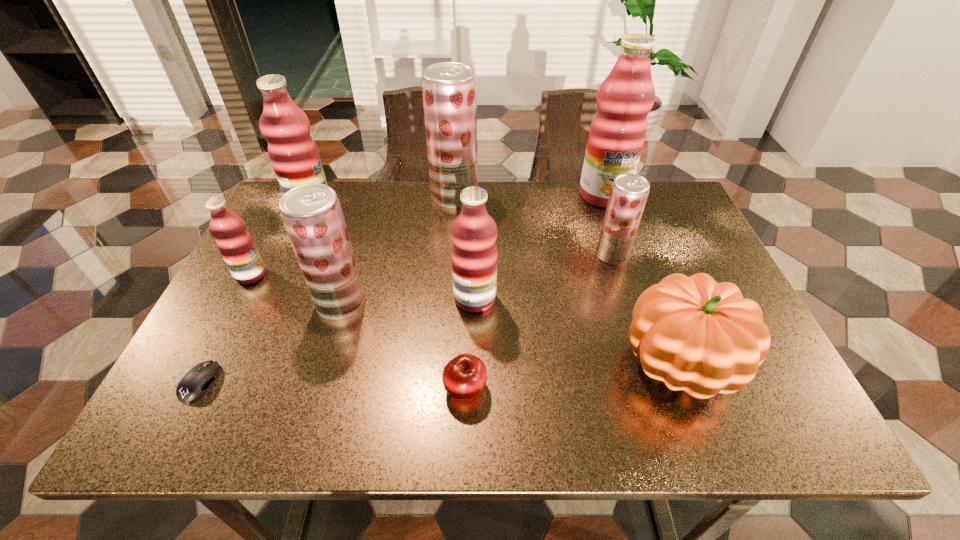
Locate an element on the screen. Image resolution: width=960 pixels, height=540 pixels. free space at the near left corner of the desktop is located at coordinates (234, 431).

Where is `free region at the far right corner of the desktop`? free region at the far right corner of the desktop is located at coordinates (659, 215).

Where is `unoccupied position between the third smallest pink fruit juice and the smallest pink fruit juice`? unoccupied position between the third smallest pink fruit juice and the smallest pink fruit juice is located at coordinates (281, 240).

You are a GUI agent. You are given a task and a screenshot of the screen. Output one action in this format:
    pyautogui.click(x=<x>, y=<y>)
    Task: Click on the free space between the pink apple and the smallest pink fruit juice
    The image size is (960, 540).
    Given the screenshot: What is the action you would take?
    pyautogui.click(x=358, y=332)

The height and width of the screenshot is (540, 960). What are the coordinates of `unoccupied area between the fourth object from left to right and the third pink fruit juice from left to right` in the screenshot? It's located at (408, 301).

You are a GUI agent. You are given a task and a screenshot of the screen. Output one action in this format:
    pyautogui.click(x=<x>, y=<y>)
    Task: Click on the free space between the orange pumpkin and the tallest object
    
    Given the screenshot: What is the action you would take?
    pyautogui.click(x=641, y=280)

Locate an element on the screen. empty space between the rightmost strawberry fruit juice and the biggest strawberry fruit juice is located at coordinates (534, 226).

At what (x,y) coordinates should I click in order to perform the action: click on free space that is in between the ninth tallest object and the third pink fruit juice from left to right. Please return your answer as a coordinate pair (x, y). The height and width of the screenshot is (540, 960). Looking at the image, I should click on (470, 343).

Locate an element on the screen. The width and height of the screenshot is (960, 540). free area in between the second smallest pink fruit juice and the fourth object from left to right is located at coordinates (408, 301).

Where is `vacant area between the fifth fruit juice from right to left and the black computer equipment`? Image resolution: width=960 pixels, height=540 pixels. vacant area between the fifth fruit juice from right to left and the black computer equipment is located at coordinates (271, 342).